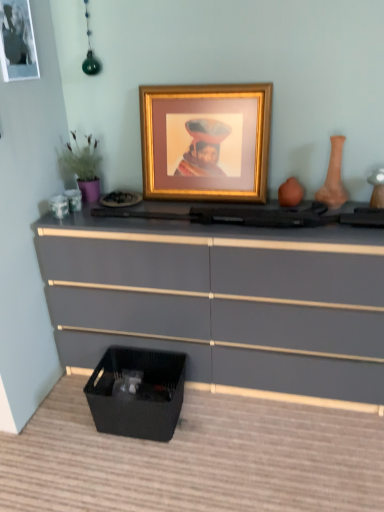
At what (x,y) coordinates should I click in order to perform the action: click on free region on the left part of black woven basket at lower left. Please return your answer as a coordinate pair (x, y). This screenshot has width=384, height=512. Looking at the image, I should click on (59, 424).